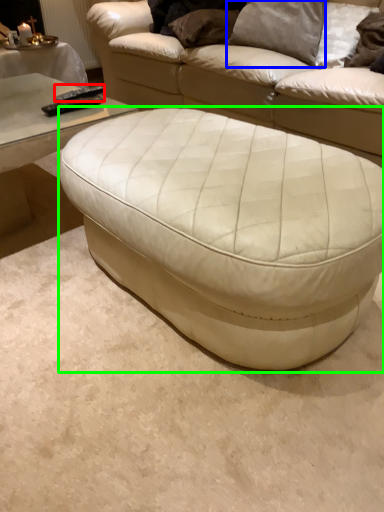
Question: Which object is the farthest from remote (highlighted by a red box)? Choose among these: pillow (highlighted by a blue box) or table (highlighted by a green box).

Choices:
 (A) pillow
 (B) table

Answer: (A)